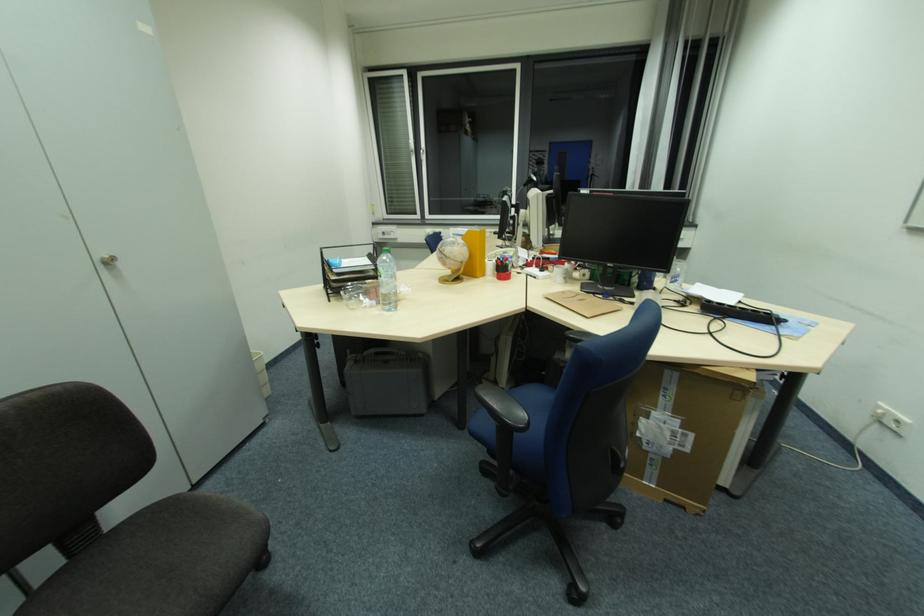
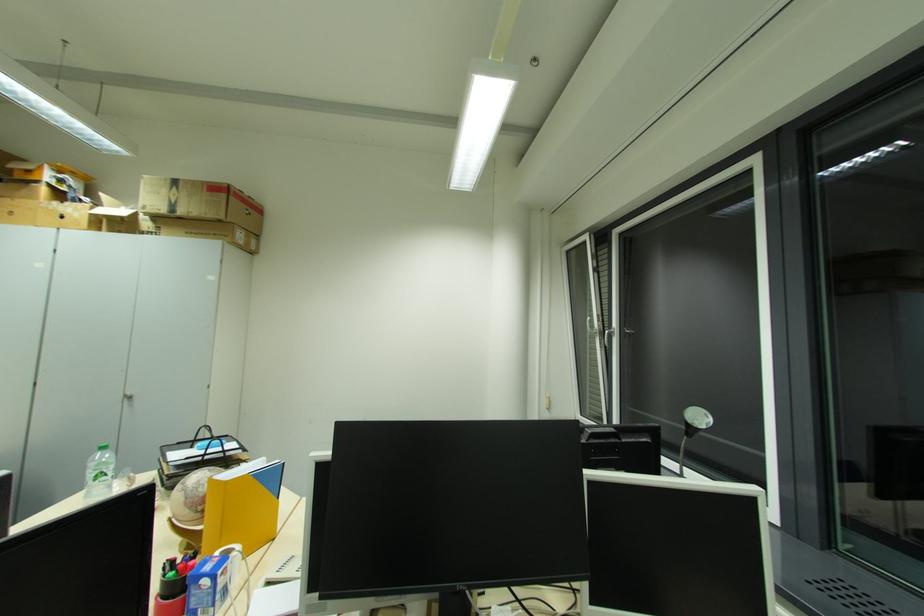
Where in the second image is the point corresponding to [415,159] from the first image?

(600, 342)